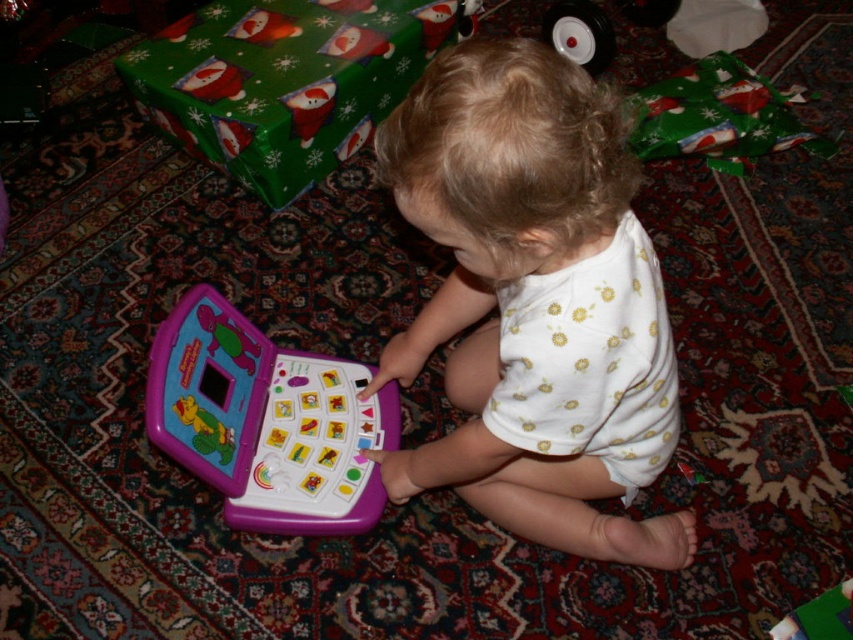
You are a parent trying to clean up the play area. You see the white dotted fabric at center and the purple plastic toy at center. Which object should you pick up first to avoid covering the toy while cleaning?

You should pick up the white dotted fabric at center first because it is in front of the purple plastic toy at center, so removing it first will prevent covering the toy during cleanup.